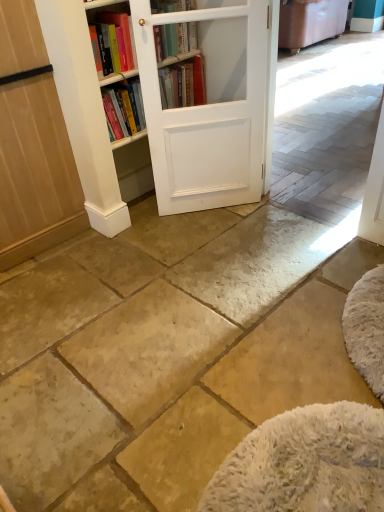
Question: From the image's perspective, is white wood bookcase at center below white matte barn door at center?

Choices:
 (A) yes
 (B) no

Answer: (B)

Question: Could you tell me if white wood bookcase at center is turned towards white matte barn door at center?

Choices:
 (A) no
 (B) yes

Answer: (A)

Question: Is white wood bookcase at center thinner than white matte barn door at center?

Choices:
 (A) no
 (B) yes

Answer: (A)

Question: Is white wood bookcase at center directly adjacent to white matte barn door at center?

Choices:
 (A) no
 (B) yes

Answer: (A)

Question: Is white matte barn door at center at the back of white wood bookcase at center?

Choices:
 (A) no
 (B) yes

Answer: (A)

Question: Does point (178, 35) appear closer or farther from the camera than point (4, 128)?

Choices:
 (A) farther
 (B) closer

Answer: (A)

Question: Considering their positions, is hardcover book at upper center located in front of or behind light brown wood screen door at left?

Choices:
 (A) behind
 (B) front

Answer: (A)

Question: From a real-world perspective, relative to light brown wood screen door at left, is hardcover book at upper center vertically above or below?

Choices:
 (A) below
 (B) above

Answer: (B)

Question: Is hardcover book at upper center wider or thinner than light brown wood screen door at left?

Choices:
 (A) wide
 (B) thin

Answer: (B)

Question: Considering the positions of light brown wood screen door at left and white matte barn door at center in the image, is light brown wood screen door at left bigger or smaller than white matte barn door at center?

Choices:
 (A) big
 (B) small

Answer: (A)

Question: Is point (51, 221) positioned closer to the camera than point (228, 1)?

Choices:
 (A) closer
 (B) farther

Answer: (B)

Question: Is light brown wood screen door at left in front of or behind white matte barn door at center in the image?

Choices:
 (A) behind
 (B) front

Answer: (B)

Question: Would you say light brown wood screen door at left is to the left or to the right of white matte barn door at center in the picture?

Choices:
 (A) right
 (B) left

Answer: (B)

Question: Is hardcover book at upper center spatially inside white wood bookcase at center, or outside of it?

Choices:
 (A) outside
 (B) inside

Answer: (A)

Question: From the image's perspective, is hardcover book at upper center located above or below white wood bookcase at center?

Choices:
 (A) above
 (B) below

Answer: (B)